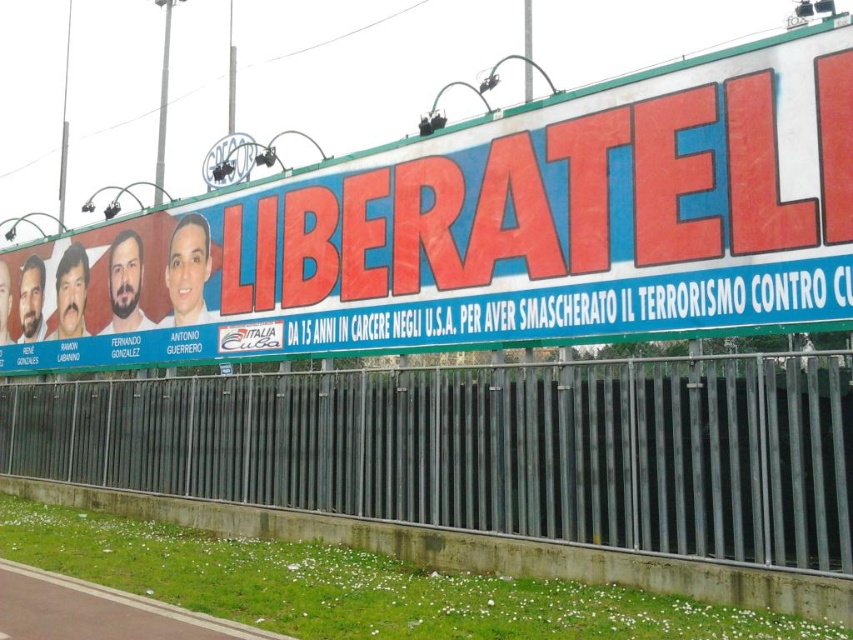
Is red plastic billboard at upper center below metallic gray fence at lower center?

No.

Between point (729, 205) and point (759, 518), which one is positioned behind?

The point (729, 205) is behind.

Identify the location of red plastic billboard at upper center. The image size is (853, 640). (486, 230).